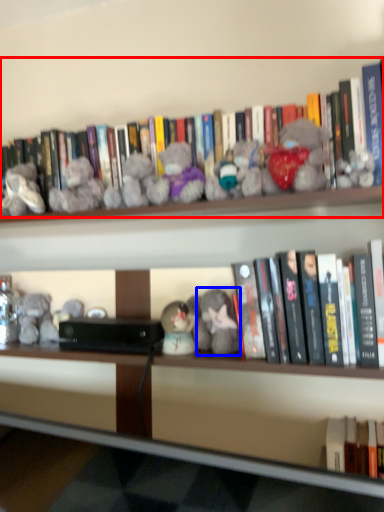
Question: Which point is closer to the camera, book (highlighted by a red box) or toy (highlighted by a blue box)?

Choices:
 (A) book
 (B) toy

Answer: (A)